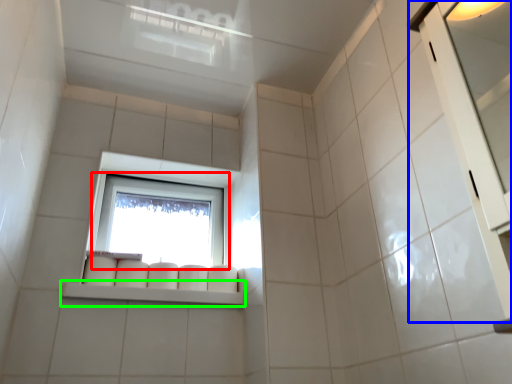
Question: Considering the real-world distances, which object is closest to window (highlighted by a red box)? screen door (highlighted by a blue box) or window sill (highlighted by a green box).

Choices:
 (A) screen door
 (B) window sill

Answer: (B)